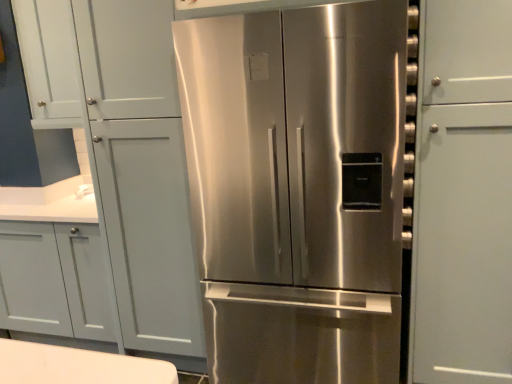
Question: Would you say stainless steel refrigerator at center is outside white matte cabinet doors at upper left?

Choices:
 (A) no
 (B) yes

Answer: (B)

Question: Can you confirm if stainless steel refrigerator at center is taller than white matte cabinet doors at upper left?

Choices:
 (A) yes
 (B) no

Answer: (A)

Question: Is stainless steel refrigerator at center facing towards white matte cabinet doors at upper left?

Choices:
 (A) no
 (B) yes

Answer: (A)

Question: Does stainless steel refrigerator at center appear on the right side of white matte cabinet doors at upper left?

Choices:
 (A) yes
 (B) no

Answer: (A)

Question: From a real-world perspective, is stainless steel refrigerator at center over white matte cabinet doors at upper left?

Choices:
 (A) no
 (B) yes

Answer: (A)

Question: From a real-world perspective, is stainless steel refrigerator at center located beneath white matte cabinet doors at upper left?

Choices:
 (A) no
 (B) yes

Answer: (B)

Question: Is the depth of white matte cabinet doors at upper left greater than that of stainless steel refrigerator at center?

Choices:
 (A) no
 (B) yes

Answer: (B)

Question: Is white matte cabinet doors at upper left aimed at stainless steel refrigerator at center?

Choices:
 (A) no
 (B) yes

Answer: (A)

Question: From a real-world perspective, does white matte cabinet doors at upper left sit lower than stainless steel refrigerator at center?

Choices:
 (A) yes
 (B) no

Answer: (B)

Question: Is white matte cabinet doors at upper left positioned in front of stainless steel refrigerator at center?

Choices:
 (A) yes
 (B) no

Answer: (B)

Question: From a real-world perspective, is white matte cabinet doors at upper left on top of stainless steel refrigerator at center?

Choices:
 (A) yes
 (B) no

Answer: (A)

Question: Does white matte cabinet doors at upper left have a greater height compared to stainless steel refrigerator at center?

Choices:
 (A) no
 (B) yes

Answer: (A)

Question: Is white matte cabinet doors at upper left in front of or behind stainless steel refrigerator at center in the image?

Choices:
 (A) behind
 (B) front

Answer: (A)